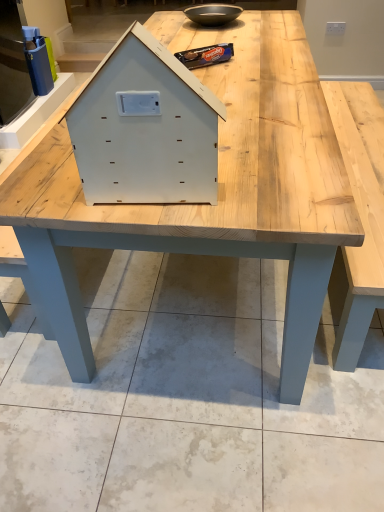
Question: From the image's perspective, is matte black bowl at upper center located beneath light wood table at center?

Choices:
 (A) no
 (B) yes

Answer: (A)

Question: Does matte black bowl at upper center lie in front of light wood table at center?

Choices:
 (A) no
 (B) yes

Answer: (A)

Question: Does matte black bowl at upper center have a greater width compared to light wood table at center?

Choices:
 (A) yes
 (B) no

Answer: (B)

Question: Considering the relative sizes of matte black bowl at upper center and light wood table at center in the image provided, is matte black bowl at upper center taller than light wood table at center?

Choices:
 (A) no
 (B) yes

Answer: (A)

Question: Is matte black bowl at upper center positioned far away from light wood table at center?

Choices:
 (A) no
 (B) yes

Answer: (A)

Question: Does matte black bowl at upper center have a lesser width compared to light wood table at center?

Choices:
 (A) yes
 (B) no

Answer: (A)

Question: Is white matte wooden house at center oriented towards light wood table at center?

Choices:
 (A) yes
 (B) no

Answer: (A)

Question: From the image's perspective, would you say white matte wooden house at center is shown under light wood table at center?

Choices:
 (A) yes
 (B) no

Answer: (A)

Question: From the image's perspective, is white matte wooden house at center over light wood table at center?

Choices:
 (A) no
 (B) yes

Answer: (A)

Question: Is the position of white matte wooden house at center more distant than that of light wood table at center?

Choices:
 (A) no
 (B) yes

Answer: (A)

Question: Considering the relative sizes of white matte wooden house at center and light wood table at center in the image provided, is white matte wooden house at center thinner than light wood table at center?

Choices:
 (A) no
 (B) yes

Answer: (B)

Question: From a real-world perspective, is white matte wooden house at center positioned over light wood table at center based on gravity?

Choices:
 (A) yes
 (B) no

Answer: (A)

Question: Can you confirm if light wood table at center is shorter than matte black bowl at upper center?

Choices:
 (A) yes
 (B) no

Answer: (B)